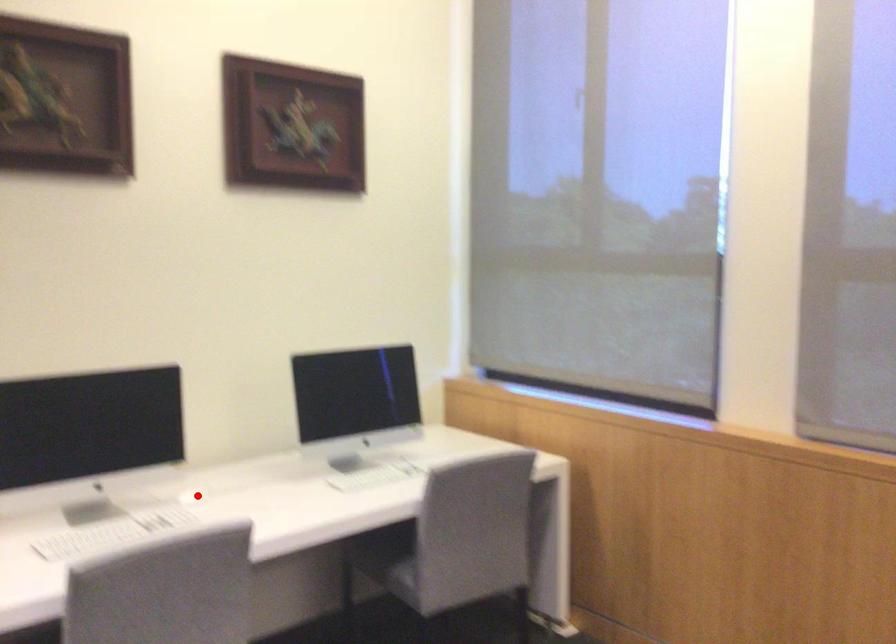
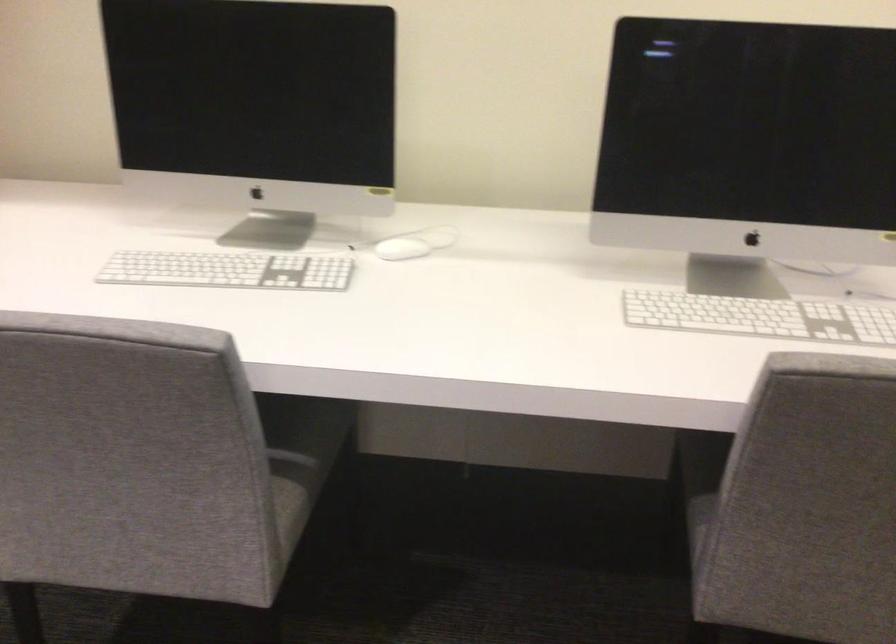
Where in the second image is the point corresponding to the highlighted location from the first image?

(401, 249)